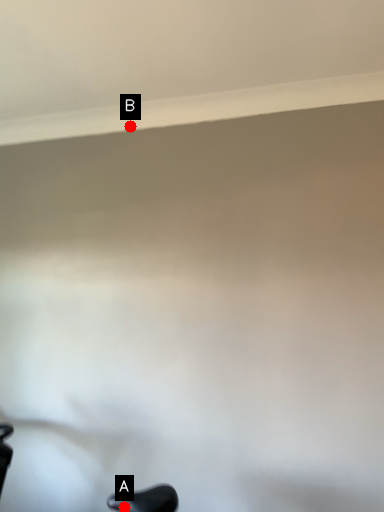
Question: Two points are circled on the image, labeled by A and B beside each circle. Which point is closer to the camera?

Choices:
 (A) A is closer
 (B) B is closer

Answer: (A)